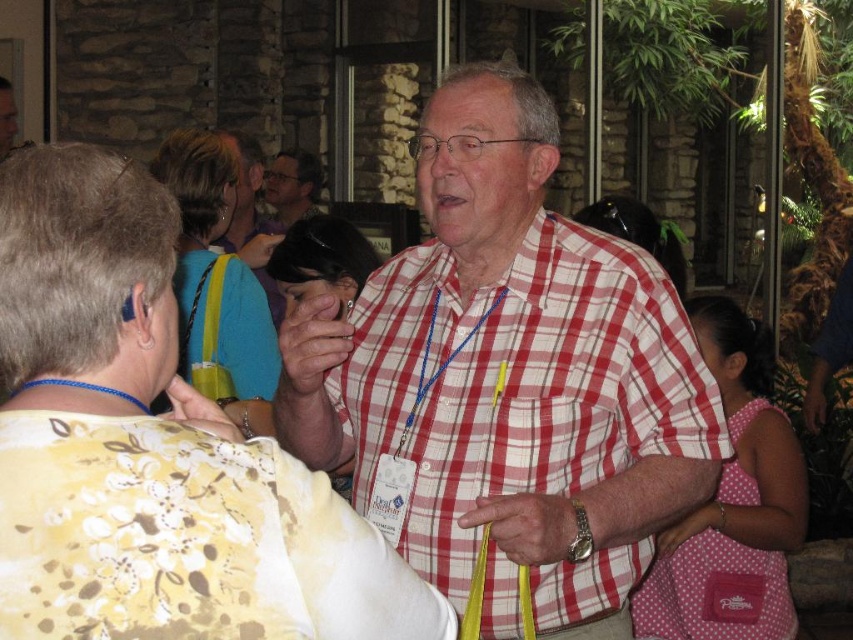
Between red checkered shirt at center and matte black glasses at upper center, which one appears on the left side from the viewer's perspective?

Positioned to the left is matte black glasses at upper center.

Who is more forward, [524,372] or [281,156]?

Point [524,372] is in front.

I want to click on red checkered shirt at center, so click(508, 380).

Where is `red checkered shirt at center`? red checkered shirt at center is located at coordinates (508, 380).

Can you confirm if red checkered shirt at center is thinner than matte yellow lanyard at upper center?

Incorrect, red checkered shirt at center's width is not less than matte yellow lanyard at upper center's.

Can you confirm if red checkered shirt at center is positioned below matte yellow lanyard at upper center?

Yes.

Is point (517, 618) closer to camera compared to point (250, 260)?

Yes.

Locate an element on the screen. red checkered shirt at center is located at coordinates (508, 380).

Is matte yellow lanyard at upper center taller than matte black glasses at upper center?

Correct, matte yellow lanyard at upper center is much taller as matte black glasses at upper center.

Is matte yellow lanyard at upper center shorter than matte black glasses at upper center?

In fact, matte yellow lanyard at upper center may be taller than matte black glasses at upper center.

Which is behind, point (276, 296) or point (308, 170)?

Positioned behind is point (308, 170).

What are the coordinates of `matte yellow lanyard at upper center` in the screenshot? It's located at (251, 220).